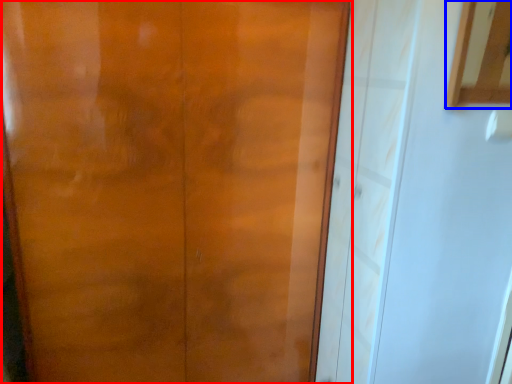
Question: Which of the following is the farthest to the observer, door (highlighted by a red box) or cabinetry (highlighted by a blue box)?

Choices:
 (A) door
 (B) cabinetry

Answer: (A)